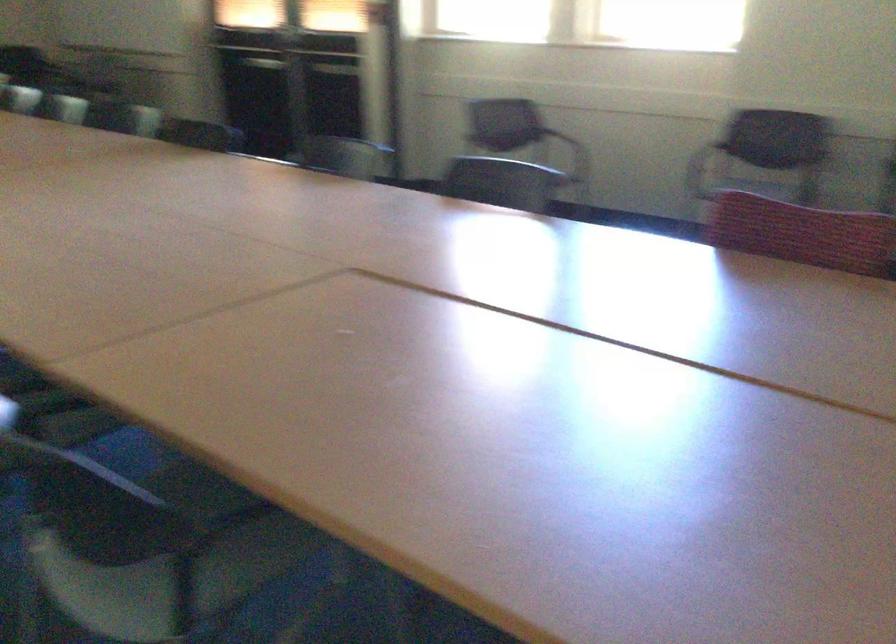
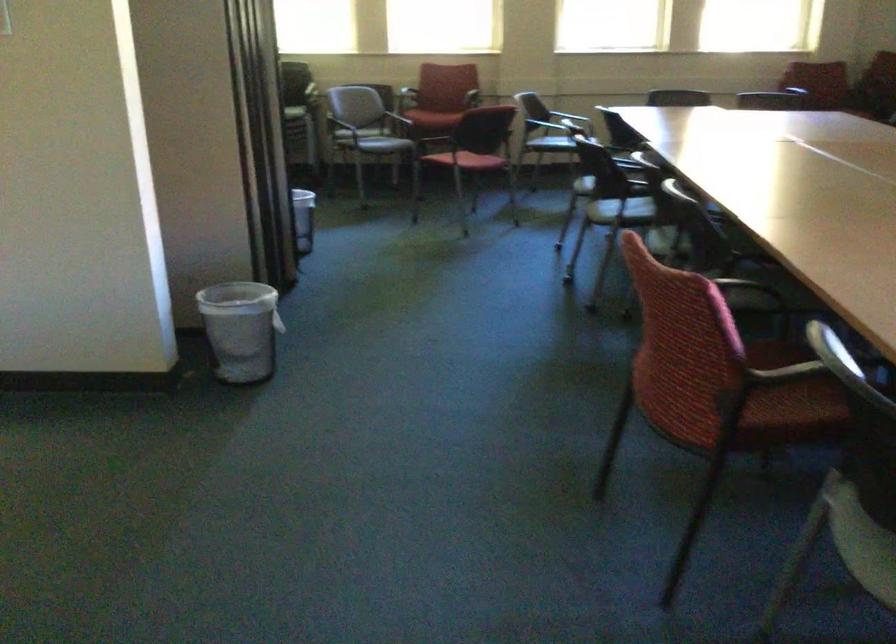
Question: The first image is from the beginning of the video and the second image is from the end. How did the camera likely rotate when shooting the video?

Choices:
 (A) Left
 (B) Right
 (C) Up
 (D) Down

Answer: (A)